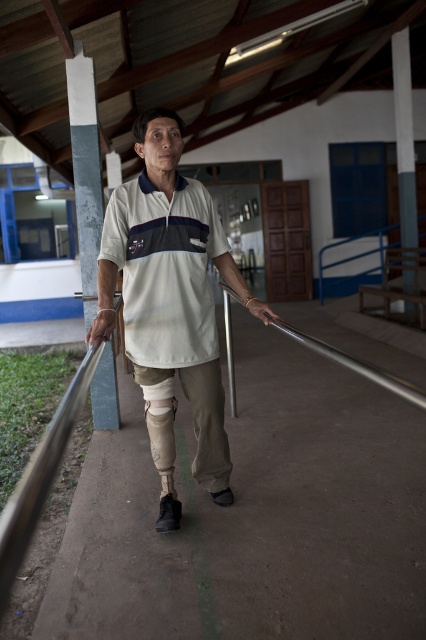
Question: Considering the real-world distances, which object is farthest from the smooth gray pole at upper right?

Choices:
 (A) silver metallic rail at center
 (B) white matte polo shirt at center
 (C) gray concrete pole at left
 (D) white matte shirt at center

Answer: (A)

Question: Does white matte shirt at center appear on the left side of smooth gray pole at upper right?

Choices:
 (A) yes
 (B) no

Answer: (A)

Question: Does white matte shirt at center appear on the right side of smooth gray pole at upper right?

Choices:
 (A) no
 (B) yes

Answer: (A)

Question: Considering the real-world distances, which object is farthest from the silver metallic rail at center?

Choices:
 (A) smooth gray pole at upper right
 (B) white matte polo shirt at center
 (C) white matte shirt at center
 (D) gray concrete pole at left

Answer: (A)

Question: Which point appears farthest from the camera in this image?

Choices:
 (A) (373, 371)
 (B) (143, 292)

Answer: (B)

Question: Considering the relative positions of white matte polo shirt at center and smooth gray pole at upper right in the image provided, where is white matte polo shirt at center located with respect to smooth gray pole at upper right?

Choices:
 (A) left
 (B) right

Answer: (A)